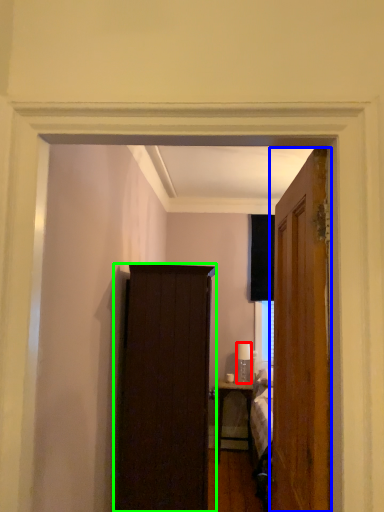
Question: Considering the real-world distances, which object is farthest from lamp (highlighted by a red box)? door (highlighted by a blue box) or cabinetry (highlighted by a green box)?

Choices:
 (A) door
 (B) cabinetry

Answer: (A)